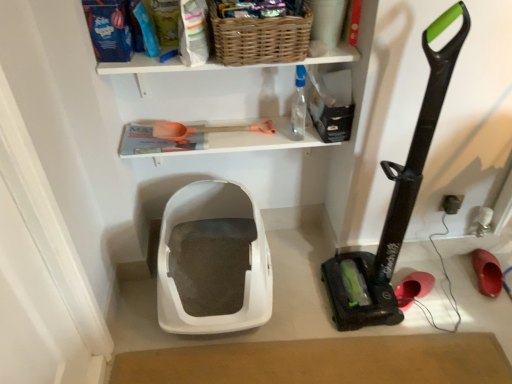
Find the location of a particular element. free space to the left of transparent plastic bottle at upper center is located at coordinates (267, 125).